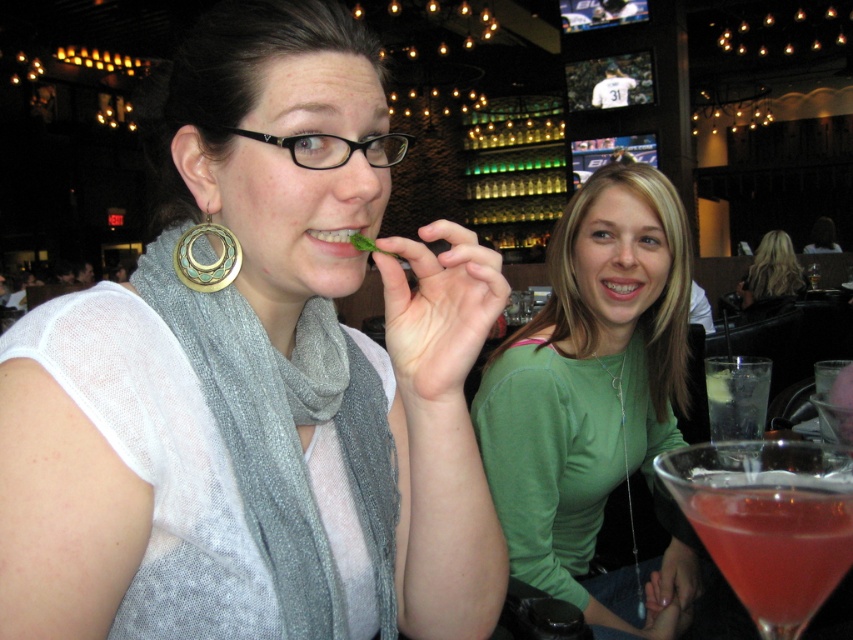
You are a photographer setting up a camera at eye level with the two women. You want to capture a closeup shot of the matte silver scarf at center without the black plastic glasses at upper center blocking the view. Is the scarf positioned in a way that allows this?

The matte silver scarf at center is taller than the black plastic glasses at upper center, so the scarf is positioned above the glasses. This means the scarf can be captured in a closeup without the glasses blocking the view.